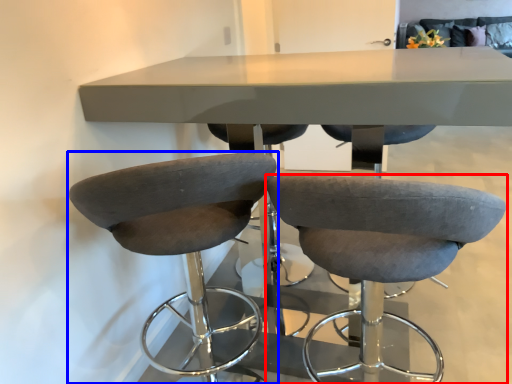
Question: Among these objects, which one is nearest to the camera, chair (highlighted by a red box) or chair (highlighted by a blue box)?

Choices:
 (A) chair
 (B) chair

Answer: (A)